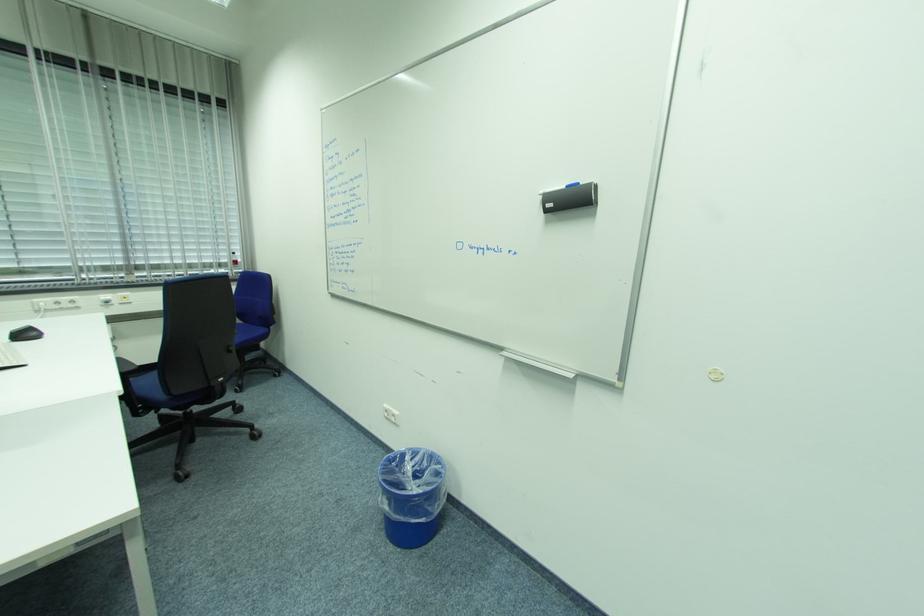
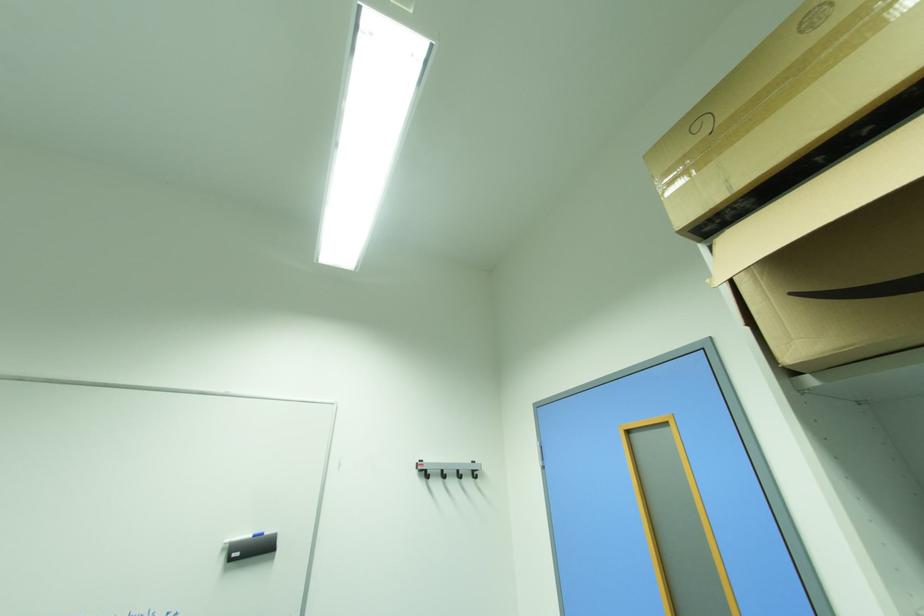
First-person continuous shooting, in which direction is the camera rotating?

The rotation direction of the camera is right-up.